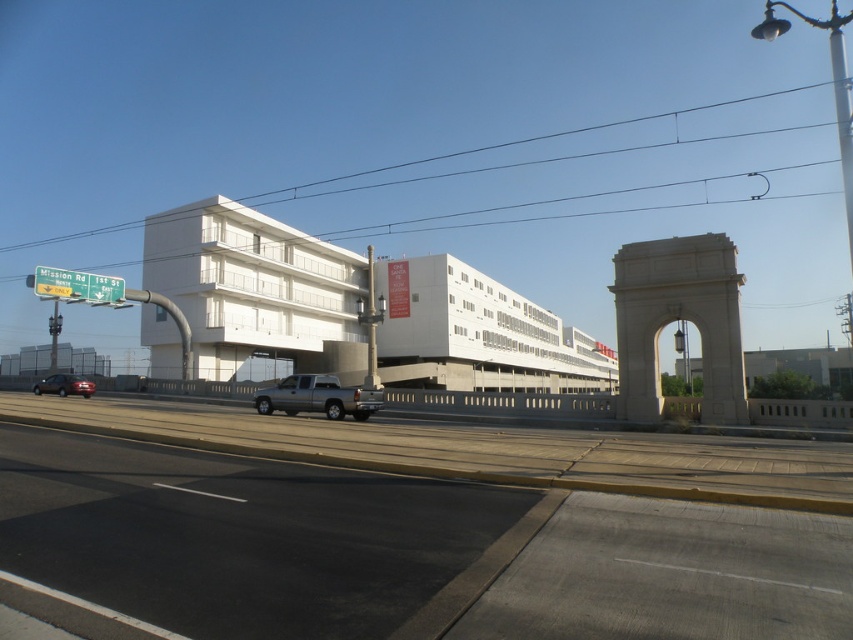
Can you confirm if gray metallic truck at center is positioned to the right of matte black suv at lower left?

Indeed, gray metallic truck at center is positioned on the right side of matte black suv at lower left.

From the picture: Is gray metallic truck at center in front of matte black suv at lower left?

Yes.

What do you see at coordinates (317, 397) in the screenshot?
I see `gray metallic truck at center` at bounding box center [317, 397].

Where is `gray metallic truck at center`? Image resolution: width=853 pixels, height=640 pixels. gray metallic truck at center is located at coordinates (317, 397).

Is asphalt road at center wider than matte black suv at lower left?

Correct, the width of asphalt road at center exceeds that of matte black suv at lower left.

Is point (376, 605) positioned after point (61, 378)?

No, it is in front of (61, 378).

Is point (730, 522) behind point (48, 387)?

No, (730, 522) is in front of (48, 387).

Identify the location of asphalt road at center. (402, 532).

Does asphalt road at center appear on the left side of gray metallic truck at center?

No, asphalt road at center is not to the left of gray metallic truck at center.

Does point (602, 548) come in front of point (331, 381)?

That is True.

Where is `asphalt road at center`? asphalt road at center is located at coordinates (402, 532).